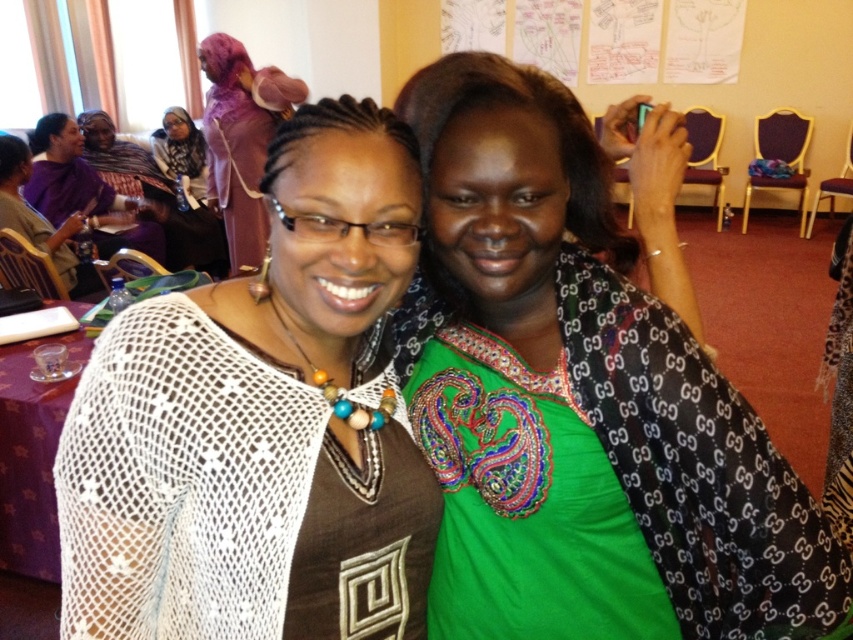
You are organizing a photo shoot and need to ensure that all items in the frame are proportionally accurate. Given the scene described, which object between the white mesh sweater at left and the white paper at upper center is smaller in size?

The white mesh sweater at left is smaller in size compared to the white paper at upper center.